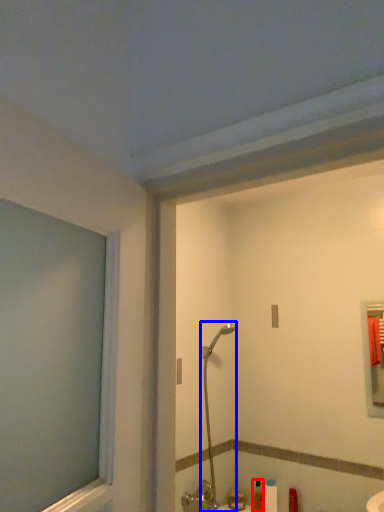
Question: Which object appears closest to the camera in this image, toiletry (highlighted by a red box) or shower (highlighted by a blue box)?

Choices:
 (A) toiletry
 (B) shower

Answer: (B)